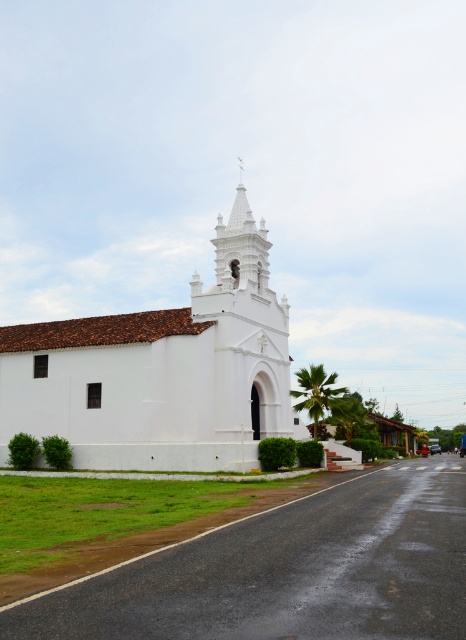
Question: Which point appears farthest from the camera in this image?

Choices:
 (A) (89, 413)
 (B) (247, 248)

Answer: (B)

Question: Is white matte church at center above white stucco spire at upper center?

Choices:
 (A) yes
 (B) no

Answer: (B)

Question: Is white matte church at center smaller than white stucco spire at upper center?

Choices:
 (A) yes
 (B) no

Answer: (A)

Question: Which of the following is the farthest from the observer?

Choices:
 (A) (95, 362)
 (B) (217, 220)

Answer: (B)

Question: Can you confirm if white matte church at center is bigger than white stucco spire at upper center?

Choices:
 (A) no
 (B) yes

Answer: (A)